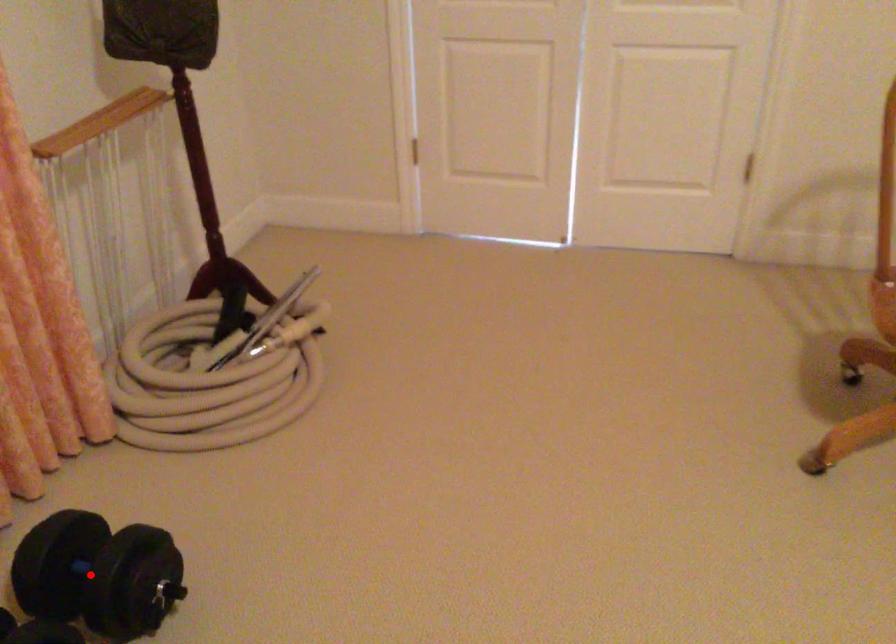
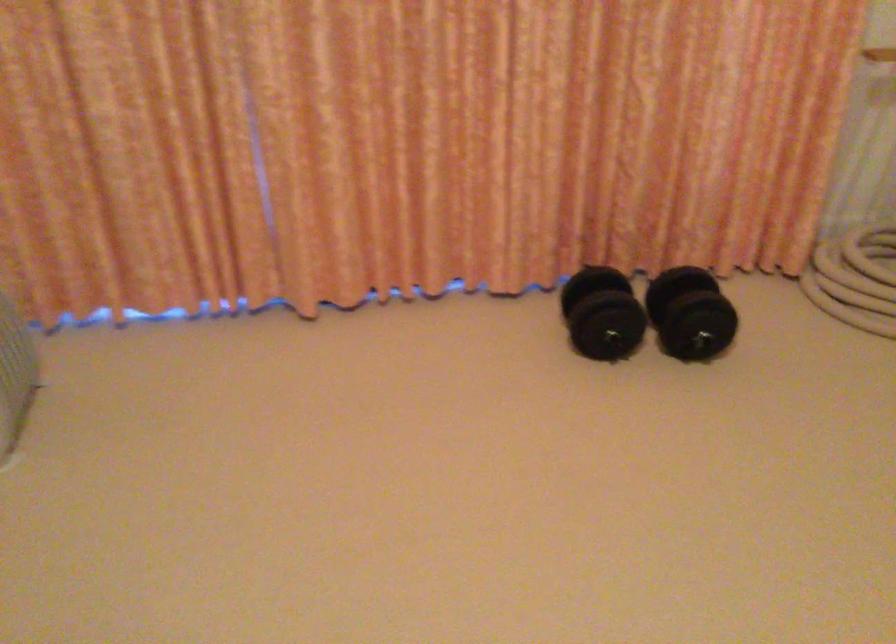
Question: A red point is marked in image1. In image2, is the corresponding 3D point closer to the camera or farther? Reply with the corresponding letter.

Choices:
 (A) The corresponding 3D point is closer.
 (B) The corresponding 3D point is farther.

Answer: (B)